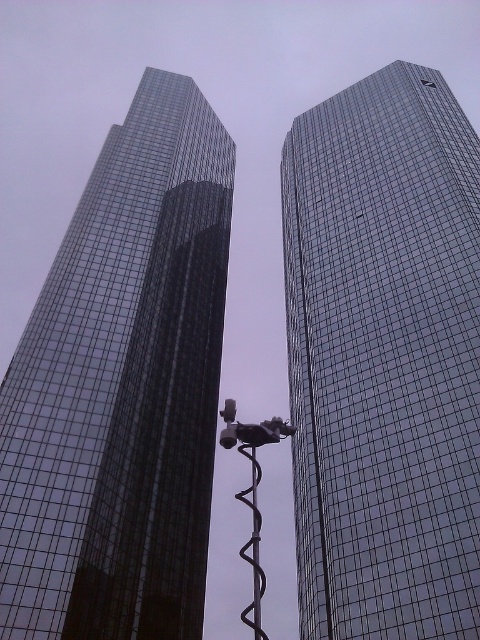
Question: Does glassy reflective skyscraper at right have a greater width compared to black rubber pole at center?

Choices:
 (A) yes
 (B) no

Answer: (A)

Question: Is glassy reflective skyscraper at right closer to camera compared to black rubber pole at center?

Choices:
 (A) yes
 (B) no

Answer: (B)

Question: Which object appears closest to the camera in this image?

Choices:
 (A) black rubber pole at center
 (B) glassy reflective skyscraper at right
 (C) glassy reflective skyscraper at left

Answer: (A)

Question: Is glassy reflective skyscraper at left above black rubber pole at center?

Choices:
 (A) no
 (B) yes

Answer: (B)

Question: Which is nearer to the glassy reflective skyscraper at right?

Choices:
 (A) black rubber pole at center
 (B) glassy reflective skyscraper at left

Answer: (B)

Question: Among these points, which one is nearest to the camera?

Choices:
 (A) (82, 269)
 (B) (315, 106)

Answer: (A)